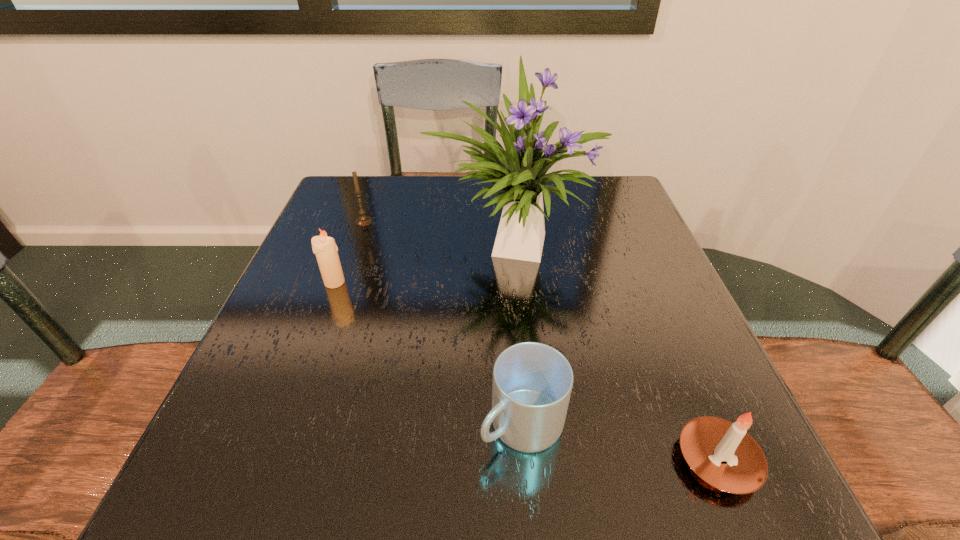
Where is `vacant space at the far edge of the desktop`? This screenshot has height=540, width=960. vacant space at the far edge of the desktop is located at coordinates [x=428, y=195].

In the image, there is a desktop. Find the location of `free space at the left edge`. free space at the left edge is located at coordinates (311, 343).

The image size is (960, 540). In the image, there is a desktop. Identify the location of vacant space at the right edge. (651, 319).

This screenshot has width=960, height=540. Identify the location of free region at the far left corner. (392, 176).

Where is `vacant space at the far right corner of the desktop`? This screenshot has height=540, width=960. vacant space at the far right corner of the desktop is located at coordinates (586, 211).

The height and width of the screenshot is (540, 960). Identify the location of empty space that is in between the flower arrangement and the farthest candle. (438, 233).

Identify the location of vacant space that is in between the farthest candle and the flower arrangement. Image resolution: width=960 pixels, height=540 pixels. (438, 233).

This screenshot has height=540, width=960. Identify the location of empty space that is in between the rightmost object and the farthest candle. (540, 341).

This screenshot has width=960, height=540. I want to click on free area in between the farthest candle and the tallest object, so click(438, 233).

What are the coordinates of `vacant space in between the nearest candle and the farthest candle` in the screenshot? It's located at (540, 341).